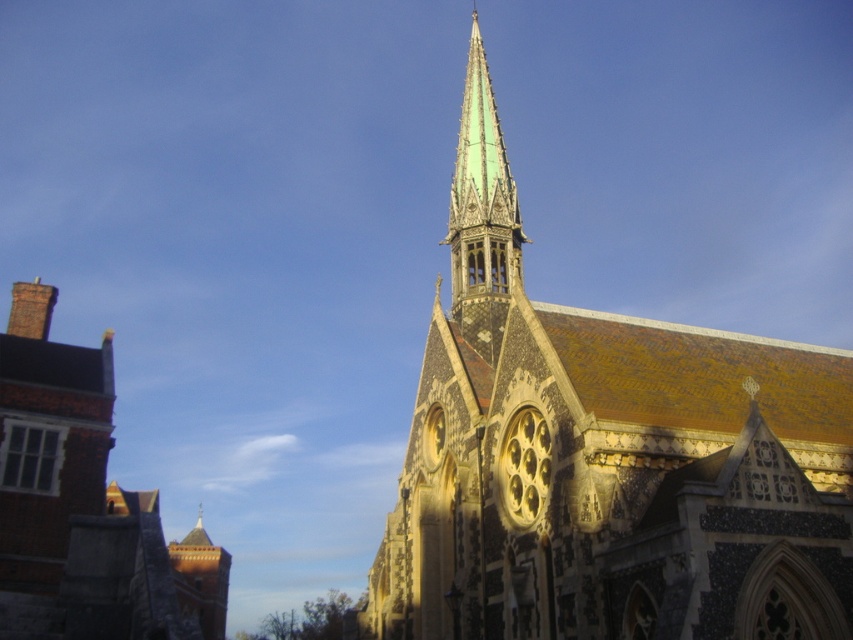
You are a bird flying over the town and want to land on the tallest structure between the speckled stone church steeple at center and the brick chimney at left. Which one should you choose?

The speckled stone church steeple at center is much taller than the brick chimney at left, so you should choose the speckled stone church steeple at center to land on.

You are standing in front of the church and want to take a photo of the speckled stone church steeple at center and the brick chimney at left. Which object will appear larger in the photo?

The speckled stone church steeple at center will appear larger in the photo because it is closer to you than the brick chimney at left.

You are standing in front of the Gothic church and notice two points marked on the ground. The first point is at coordinates point (550, 321) and the second is at point (35, 282). Which point is closer to you as you face the church?

Point (550, 321) is in front of point (35, 282), so the first point is closer to you as you face the church.